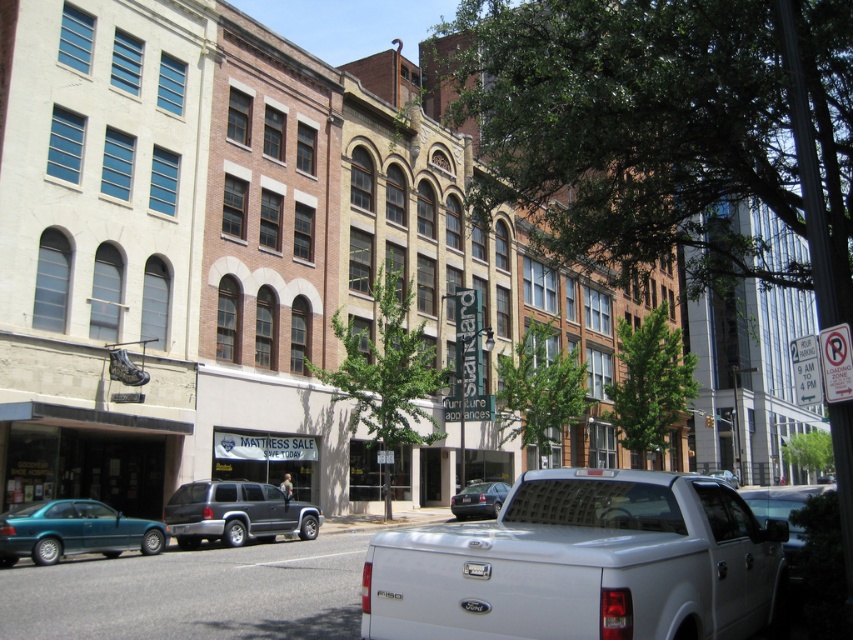
Looking at this image, which is more to the left, white matte truck bed at center or teal glossy sedan at lower left?

teal glossy sedan at lower left

Can you confirm if white matte truck bed at center is positioned above teal glossy sedan at lower left?

Yes.

What are the coordinates of `white matte truck bed at center` in the screenshot? It's located at (584, 564).

Who is positioned more to the left, matte gray suv at center or metallic silver truck at right?

From the viewer's perspective, matte gray suv at center appears more on the left side.

The width and height of the screenshot is (853, 640). What do you see at coordinates (236, 513) in the screenshot?
I see `matte gray suv at center` at bounding box center [236, 513].

This screenshot has width=853, height=640. What do you see at coordinates (236, 513) in the screenshot? I see `matte gray suv at center` at bounding box center [236, 513].

Locate an element on the screen. matte gray suv at center is located at coordinates (236, 513).

The width and height of the screenshot is (853, 640). What do you see at coordinates (782, 509) in the screenshot? I see `metallic silver truck at right` at bounding box center [782, 509].

Can you confirm if metallic silver truck at right is positioned above shiny black sedan at center?

No.

The width and height of the screenshot is (853, 640). In order to click on metallic silver truck at right in this screenshot , I will do `click(782, 509)`.

Find the location of `metallic silver truck at right`. metallic silver truck at right is located at coordinates (782, 509).